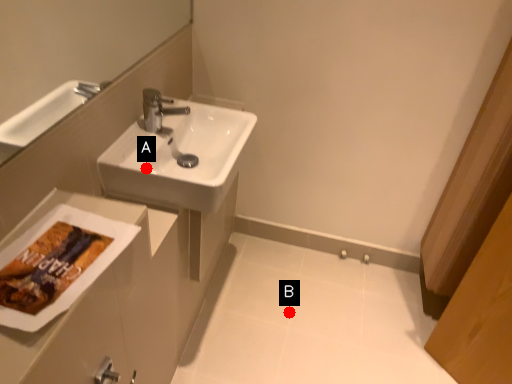
Question: Two points are circled on the image, labeled by A and B beside each circle. Which point is farther from the camera taking this photo?

Choices:
 (A) A is further
 (B) B is further

Answer: (B)